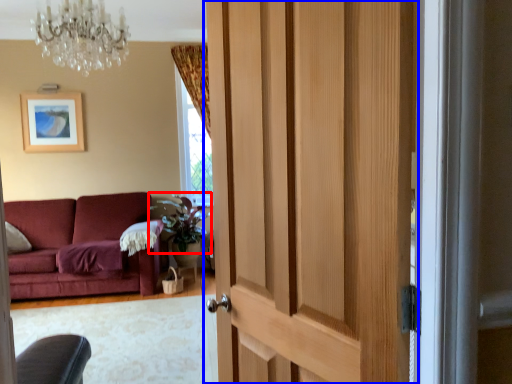
Question: Which object is further to the camera taking this photo, plant (highlighted by a red box) or door (highlighted by a blue box)?

Choices:
 (A) plant
 (B) door

Answer: (A)